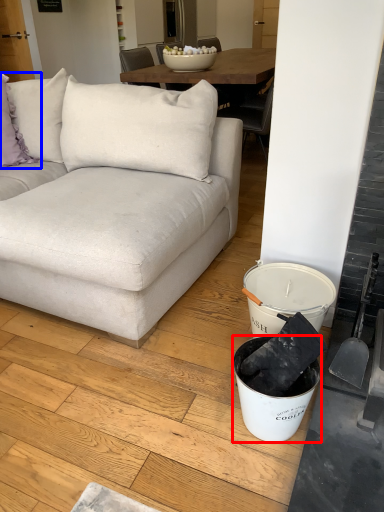
Question: Which object is closer to the camera taking this photo, bucket (highlighted by a red box) or pillow (highlighted by a blue box)?

Choices:
 (A) bucket
 (B) pillow

Answer: (A)